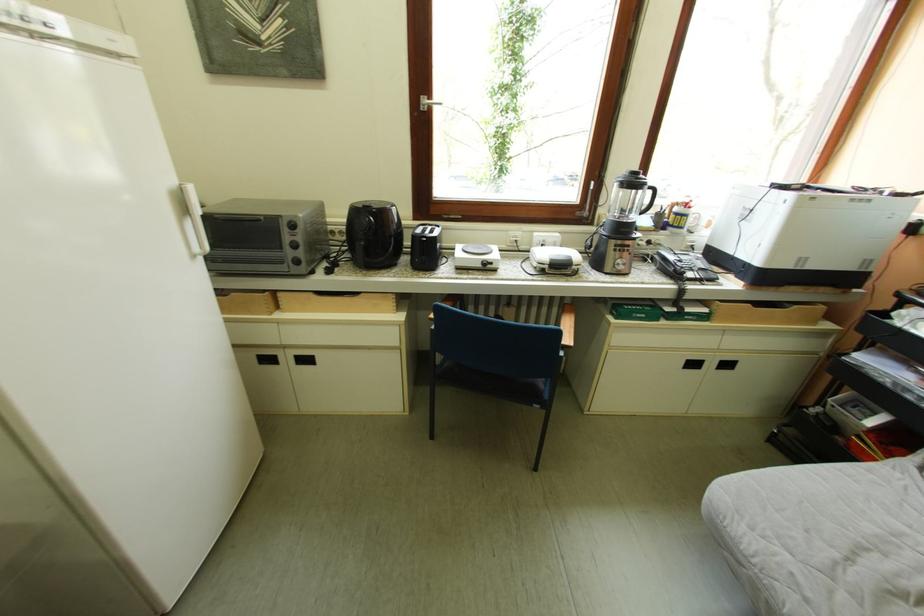
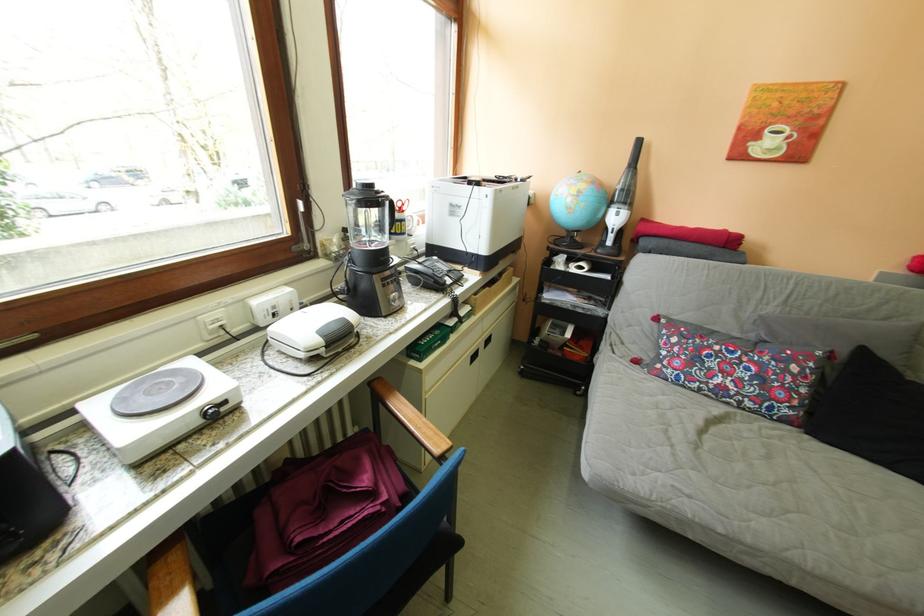
Where in the second image is the point corresponding to [504,265] from the first image?

(237, 406)